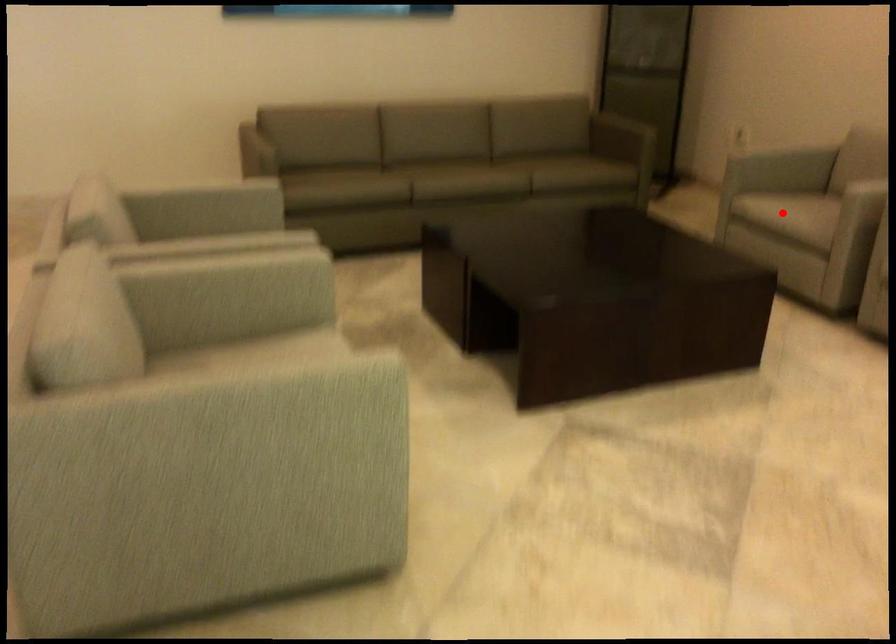
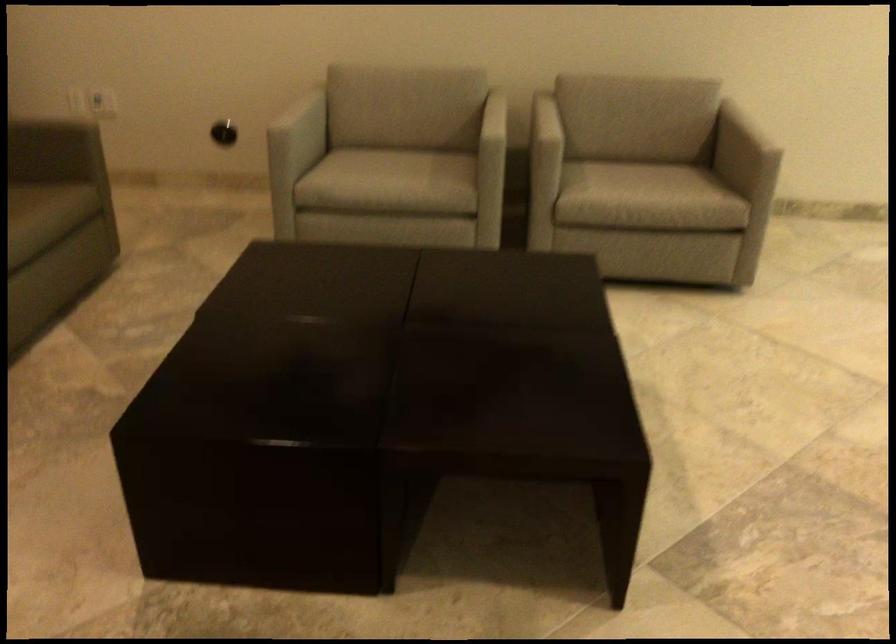
Question: A red point is marked in image1. In image2, is the corresponding 3D point closer to the camera or farther? Reply with the corresponding letter.

Choices:
 (A) The corresponding 3D point is closer.
 (B) The corresponding 3D point is farther.

Answer: (A)